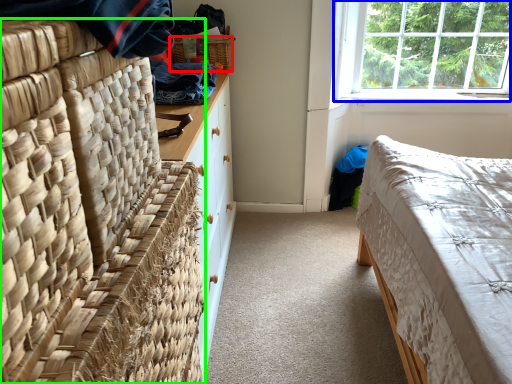
Question: Which object is positioned closest to picnic basket (highlighted by a red box)? Select from window (highlighted by a blue box) and furniture (highlighted by a green box).

Choices:
 (A) window
 (B) furniture

Answer: (A)